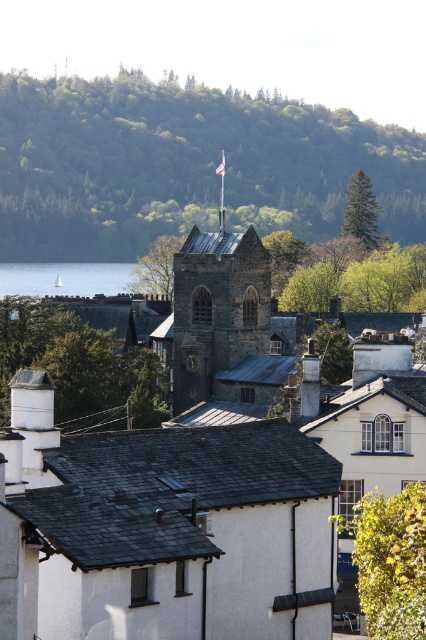
Question: Does dark gray slate roof at center appear on the left side of shiny slate roof at center?

Choices:
 (A) no
 (B) yes

Answer: (A)

Question: Which is farther from the transparent water at lower left?

Choices:
 (A) green leafy hillside at upper center
 (B) shiny slate roof at center
 (C) dark gray slate roof at center

Answer: (C)

Question: Is green leafy hillside at upper center thinner than transparent water at lower left?

Choices:
 (A) yes
 (B) no

Answer: (B)

Question: Can you confirm if green leafy hillside at upper center is smaller than transparent water at lower left?

Choices:
 (A) no
 (B) yes

Answer: (A)

Question: Which point is closer to the camera?

Choices:
 (A) (135, 561)
 (B) (129, 269)
 (C) (244, 234)

Answer: (A)

Question: Which object appears farthest from the camera in this image?

Choices:
 (A) shiny slate roof at center
 (B) dark gray slate roof at center
 (C) transparent water at lower left
 (D) green leafy hillside at upper center

Answer: (D)